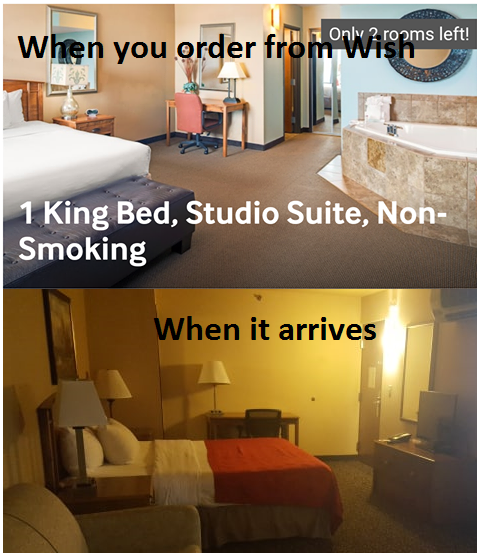
I want to click on ottoman, so click(x=138, y=198).